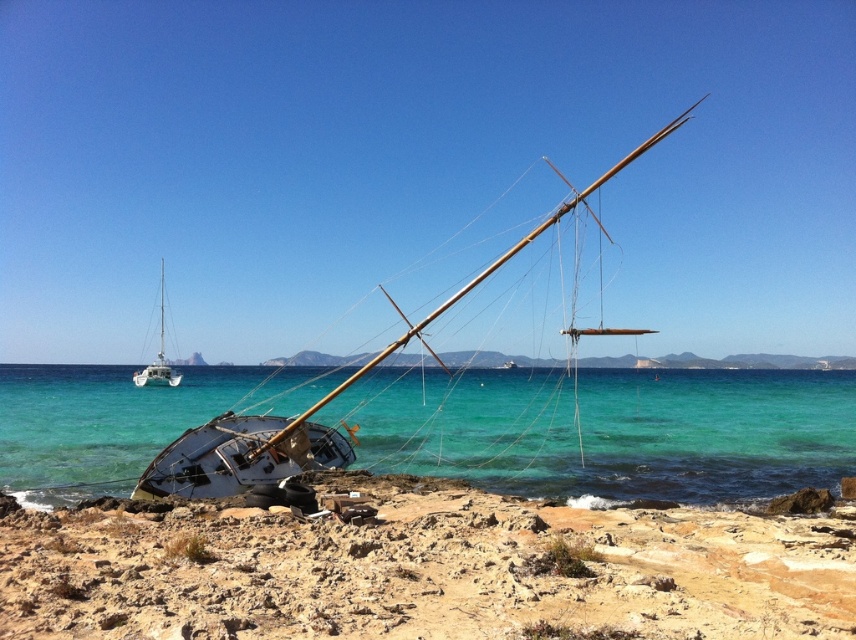
You are a photographer planning to capture the rusty metal boat at lower left and the clear turquoise water at lower center in a single frame. Based on their sizes in the scene, which object will occupy more of the photo?

The clear turquoise water at lower center will occupy more of the photo since it is larger than the rusty metal boat at lower left.

You are a photographer planning to capture the clear turquoise water at lower center and the white matte sailboat at left in a single frame. Which object should you focus on first if you want to ensure both are in focus without adjusting your camera settings?

You should focus on the white matte sailboat at left first because it is closer to the camera than the clear turquoise water at lower center. By focusing on the closer object, the farther object will still be within the depth of field.